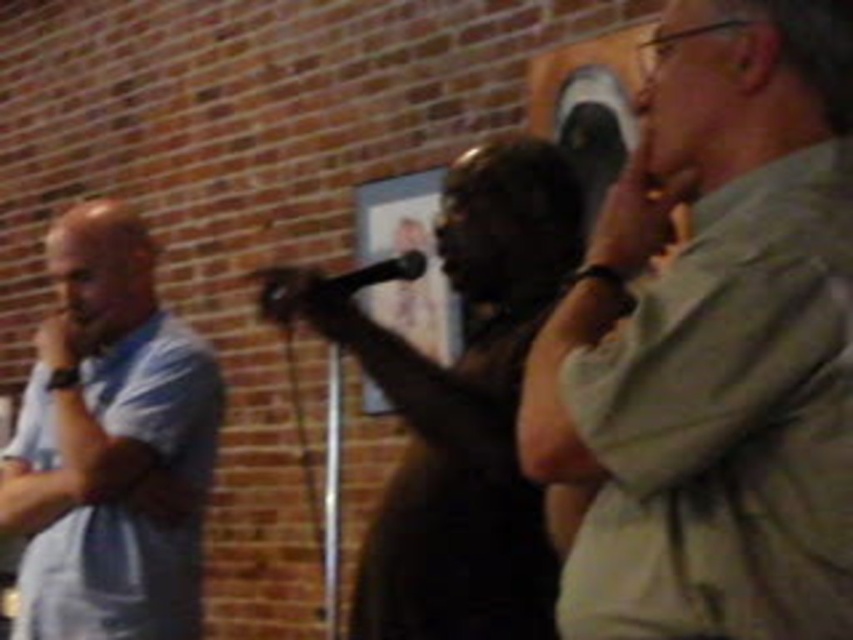
Is light khaki shirt at right to the right of black plastic microphone at center from the viewer's perspective?

Correct, you'll find light khaki shirt at right to the right of black plastic microphone at center.

Does light khaki shirt at right have a greater width compared to black plastic microphone at center?

Yes.

Image resolution: width=853 pixels, height=640 pixels. I want to click on light khaki shirt at right, so [x=714, y=342].

Is matte black dress at center below black plastic microphone at center?

Yes.

Does point (466, 252) come closer to viewer compared to point (268, 301)?

Yes, point (466, 252) is in front of point (268, 301).

Which is in front, point (485, 184) or point (357, 284)?

Point (485, 184) is more forward.

This screenshot has width=853, height=640. I want to click on matte black dress at center, so click(x=462, y=408).

Which is in front, point (769, 173) or point (160, 572)?

Positioned in front is point (769, 173).

Does point (821, 369) come in front of point (143, 266)?

Yes, point (821, 369) is closer to viewer.

This screenshot has width=853, height=640. Describe the element at coordinates (714, 342) in the screenshot. I see `light khaki shirt at right` at that location.

Where is `light khaki shirt at right`? light khaki shirt at right is located at coordinates (714, 342).